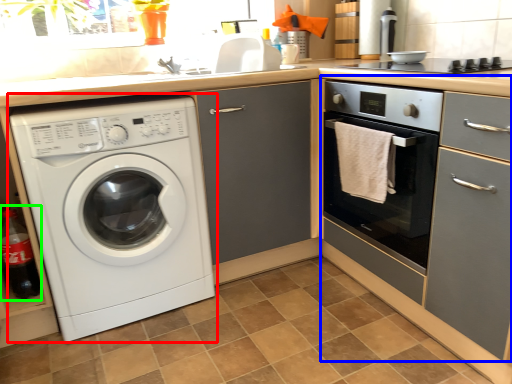
Question: Which object is positioned closest to washing machine (highlighted by a red box)? Select from cabinetry (highlighted by a blue box) and bottle (highlighted by a green box).

Choices:
 (A) cabinetry
 (B) bottle

Answer: (B)